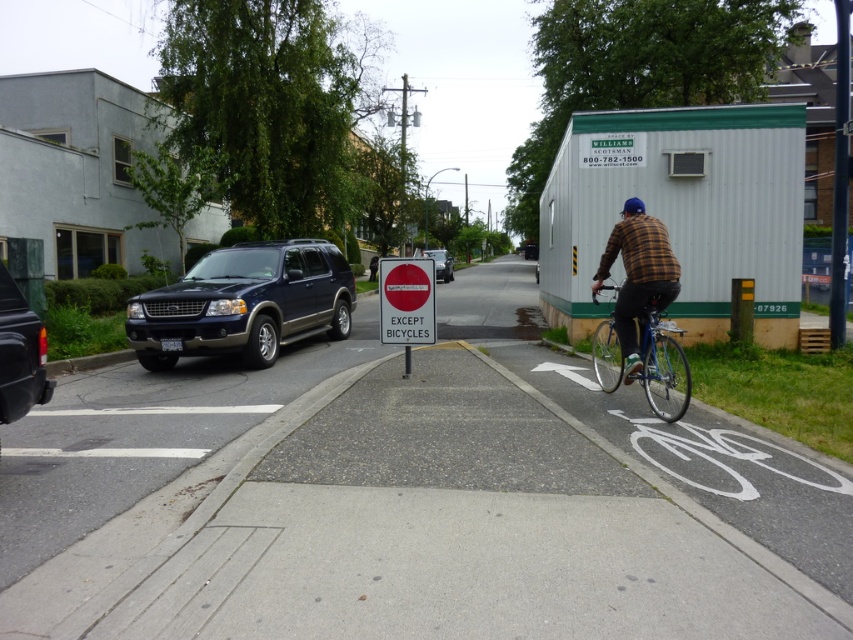
You are a delivery driver who needs to park your vehicle, which is 1.8 meters tall, near the red plastic sign at center. Can your vehicle fit under the height restriction indicated by the shiny dark blue suv at left?

The shiny dark blue suv at left is taller than the red plastic sign at center, so the height restriction might be lower than the SUV. Since your vehicle is 1.8 meters tall, it might not fit. Check the actual height limit posted on the sign or nearby area for accurate information.

You are a delivery person on a bicycle. You need to deliver a package to a location just past the No Entry sign. The road ahead is narrow. Your bicycle is 1.2 meters long. Is there enough space between the shiny metallic bicycle at right and the camera to pass through?

The distance between the shiny metallic bicycle at right and the camera is 6.22 meters. Since your bicycle is only 1.2 meters long, there is ample space to pass through the area safely.

From the picture: You are a cyclist approaching the intersection and see the red plastic sign at center and the matte black suv at center. According to the sign, can you ride your bicycle through this area?

The red plastic sign at center is positioned under matte black suv at center, so the sign is partially obscured by the SUV. Therefore, it is unclear whether the bicycle is permitted to pass through this area.